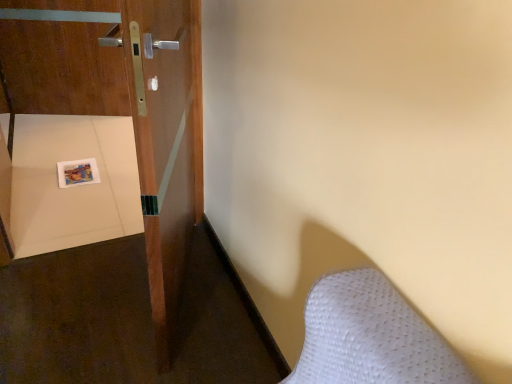
The height and width of the screenshot is (384, 512). What do you see at coordinates (77, 172) in the screenshot?
I see `matte plastic tray at lower left` at bounding box center [77, 172].

Locate an element on the screen. matte plastic tray at lower left is located at coordinates (77, 172).

Describe the element at coordinates (123, 106) in the screenshot. I see `wooden door at left` at that location.

In order to click on wooden door at left in this screenshot , I will do `click(123, 106)`.

You are a GUI agent. You are given a task and a screenshot of the screen. Output one action in this format:
    pyautogui.click(x=<x>, y=<y>)
    Task: Click on the matte plastic tray at lower left
    
    Given the screenshot: What is the action you would take?
    pyautogui.click(x=77, y=172)

Considering the positions of objects matte plastic tray at lower left and wooden door at left in the image provided, who is more to the left, matte plastic tray at lower left or wooden door at left?

Positioned to the left is matte plastic tray at lower left.

Between matte plastic tray at lower left and wooden door at left, which one is positioned in front?

wooden door at left is more forward.

Is point (80, 181) farther from camera compared to point (194, 43)?

Yes, it is.

From the image's perspective, which object appears higher, matte plastic tray at lower left or wooden door at left?

wooden door at left, from the image's perspective.

From a real-world perspective, does matte plastic tray at lower left stand above wooden door at left?

No, from a real-world perspective, matte plastic tray at lower left is not on top of wooden door at left.

Looking at their sizes, would you say matte plastic tray at lower left is wider or thinner than wooden door at left?

In the image, matte plastic tray at lower left appears to be wider than wooden door at left.

Which of these two, matte plastic tray at lower left or wooden door at left, stands taller?

wooden door at left is taller.

Based on the photo, can you confirm if matte plastic tray at lower left is smaller than wooden door at left?

Yes, matte plastic tray at lower left is smaller than wooden door at left.

Looking at this image, would you say matte plastic tray at lower left contains wooden door at left?

No, matte plastic tray at lower left does not contain wooden door at left.

Is matte plastic tray at lower left with wooden door at left?

No, matte plastic tray at lower left is not in contact with wooden door at left.

Does matte plastic tray at lower left turn towards wooden door at left?

No, matte plastic tray at lower left is not aimed at wooden door at left.

Find the location of a particular element. The height and width of the screenshot is (384, 512). copy directly beneath the wooden door at left (from a real-world perspective) is located at coordinates (77, 172).

Visually, is wooden door at left positioned to the left or to the right of matte plastic tray at lower left?

wooden door at left is positioned on matte plastic tray at lower left's right side.

Between wooden door at left and matte plastic tray at lower left, which one is positioned behind?

matte plastic tray at lower left is further from the camera.

Which is behind, point (180, 244) or point (60, 171)?

Point (60, 171)

From the image's perspective, does wooden door at left appear higher than matte plastic tray at lower left?

Correct, wooden door at left appears higher than matte plastic tray at lower left in the image.

From a real-world perspective, is wooden door at left under matte plastic tray at lower left?

Incorrect, from a real-world perspective, wooden door at left is higher than matte plastic tray at lower left.

Which of these two, wooden door at left or matte plastic tray at lower left, is thinner?

wooden door at left is thinner.

Does wooden door at left have a greater height compared to matte plastic tray at lower left?

Yes, wooden door at left is taller than matte plastic tray at lower left.

Can you confirm if wooden door at left is bigger than matte plastic tray at lower left?

Correct, wooden door at left is larger in size than matte plastic tray at lower left.

Choose the correct answer: Is wooden door at left inside matte plastic tray at lower left or outside it?

wooden door at left is spatially situated outside matte plastic tray at lower left.

Would you consider wooden door at left to be distant from matte plastic tray at lower left?

That's not correct — wooden door at left is a little close to matte plastic tray at lower left.

Is wooden door at left looking in the opposite direction of matte plastic tray at lower left?

Yes.

Identify the location of copy on the left of wooden door at left. The image size is (512, 384). (77, 172).

Identify the location of door located above the matte plastic tray at lower left (from the image's perspective). (123, 106).

I want to click on door on the right of matte plastic tray at lower left, so click(x=123, y=106).